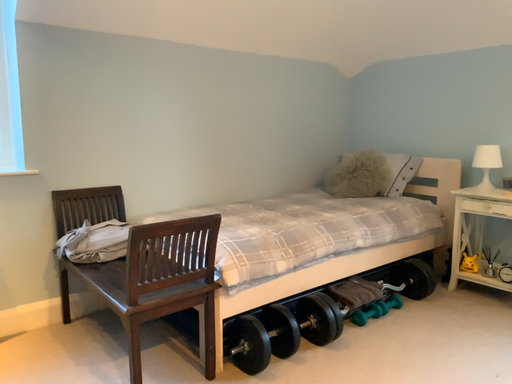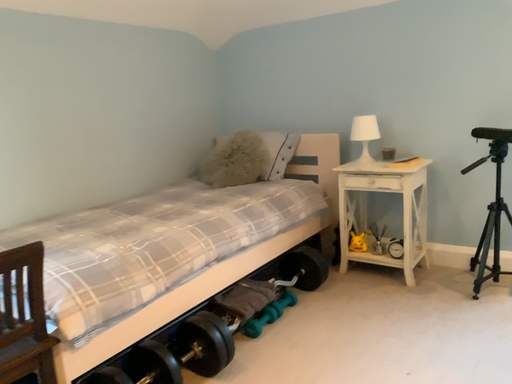
Question: How did the camera likely rotate when shooting the video?

Choices:
 (A) rotated right
 (B) rotated left

Answer: (A)